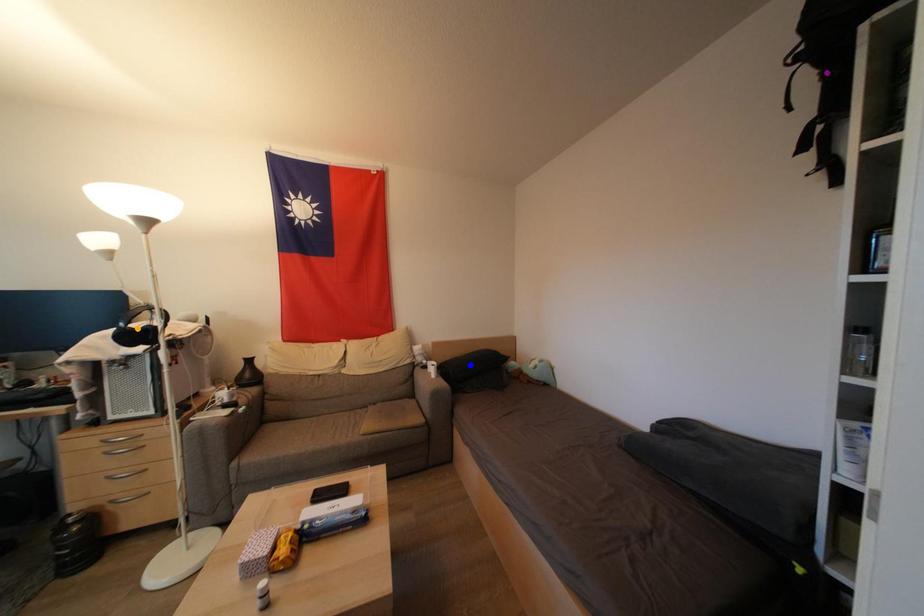
Based on the photo, order these from nearest to farthest:
blue point, orange point, purple point

purple point
orange point
blue point